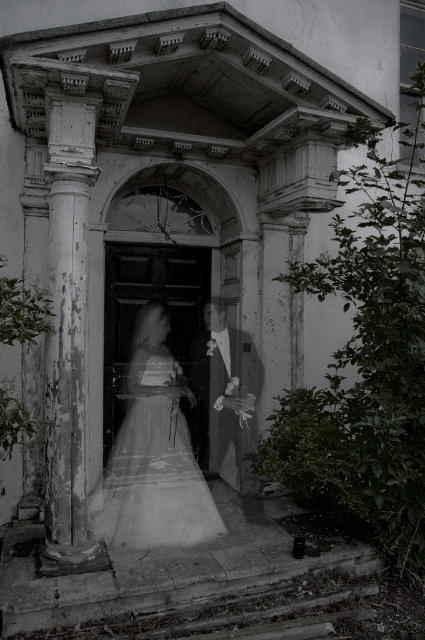
Question: Is weathered stone column at left in front of white tulle dress at center?

Choices:
 (A) no
 (B) yes

Answer: (B)

Question: In this image, where is white tulle dress at center located relative to smooth white suit at center?

Choices:
 (A) right
 (B) left

Answer: (B)

Question: Estimate the real-world distances between objects in this image. Which object is closer to the smooth white suit at center?

Choices:
 (A) weathered stone column at left
 (B) white tulle dress at center

Answer: (B)

Question: Which object is the closest to the smooth white suit at center?

Choices:
 (A) white tulle dress at center
 (B) weathered stone column at left

Answer: (A)

Question: Does weathered stone column at left appear over white tulle dress at center?

Choices:
 (A) no
 (B) yes

Answer: (B)

Question: Which point is closer to the camera taking this photo?

Choices:
 (A) (64, 483)
 (B) (132, 492)
 (C) (227, 330)

Answer: (A)